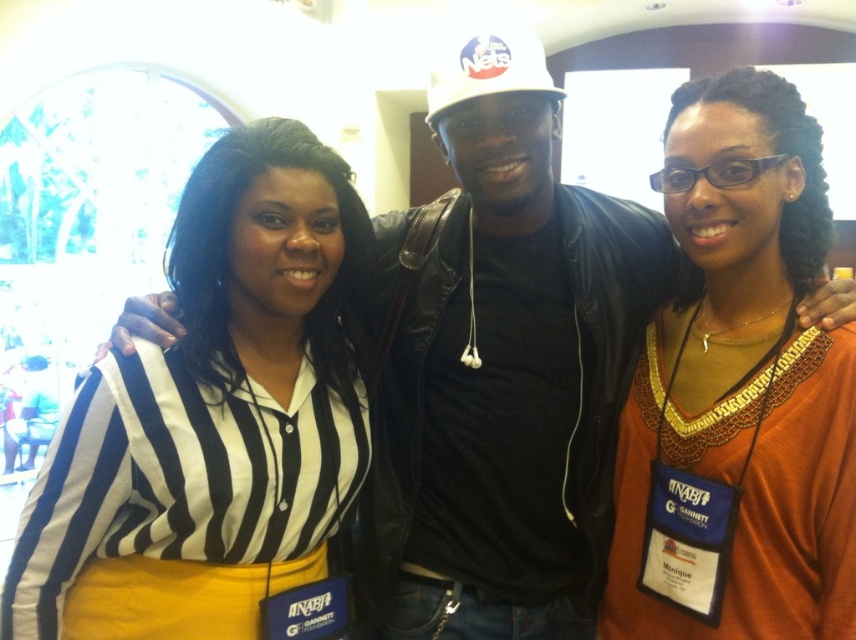
You are attending a networking event and need to introduce yourself to the person wearing the orange fabric shirt at center. However, there is someone in the way wearing the white matte baseball cap at center. Can you approach them directly, or will you need to go around?

The orange fabric shirt at center is in front of the white matte baseball cap at center, so you will need to go around the person wearing the white matte baseball cap at center to reach the person in the orange fabric shirt at center.

You are a photographer standing 5 feet away from the camera. You want to take a closeup shot of the striped fabric shirt at center. Is the shirt within your reach to adjust its position?

The striped fabric shirt at center is 4.10 feet from the camera. Since you are standing 5 feet away from the camera, the shirt is 0.9 feet away from you. This distance is within a comfortable reach, so you can easily adjust its position.

You are a photographer at the event and need to adjust the camera focus. The striped fabric shirt at center and the white matte baseball cap at center are both in the frame. Can you focus on both objects simultaneously if your camera has a depth of field that can cover 60 centimeters?

The striped fabric shirt at center and white matte baseball cap at center are 63.48 centimeters apart. Since the distance between them exceeds the camera depth of field of 60 centimeters, you cannot focus on both simultaneously.